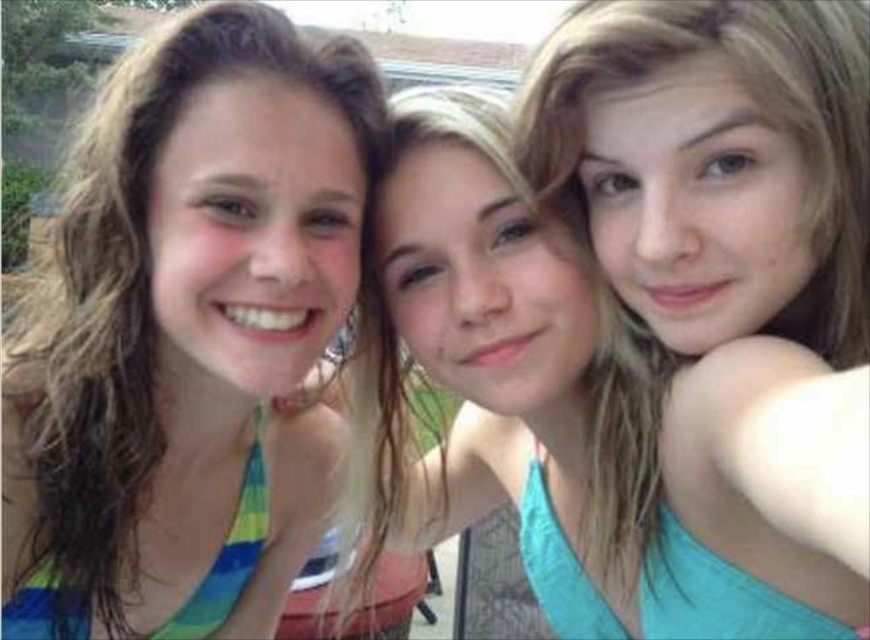
You are taking a photo of two points in the scene. The first point is point (566, 401) and the second is point (814, 58). Which point is closer to the camera?

Point (814, 58) is closer to the camera because it is in front of point (566, 401).

You are a photographer trying to adjust the lighting for a group photo. You need to ensure that the blue striped swimsuit at left and the matte teal tank top at center are both well lit. Considering their sizes, which one might require more lighting adjustments to ensure visibility?

The blue striped swimsuit at left occupies less space than matte teal tank top at center, so it might require more lighting adjustments to ensure visibility.

In the scene shown: You are taking a photo of the three people in the image. You want to ensure that the blonde hair at upper right and the blue striped swimsuit at left are both clearly visible in the photo. Based on their positions, which one is closer to the camera?

The blue striped swimsuit at left is closer to the camera than the blonde hair at upper right because the blonde hair at upper right is positioned behind it.